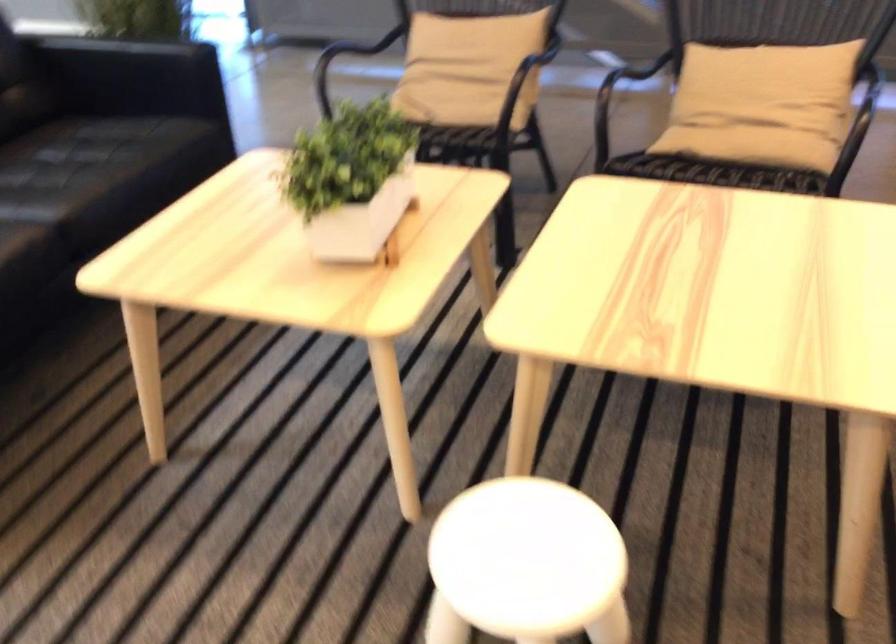
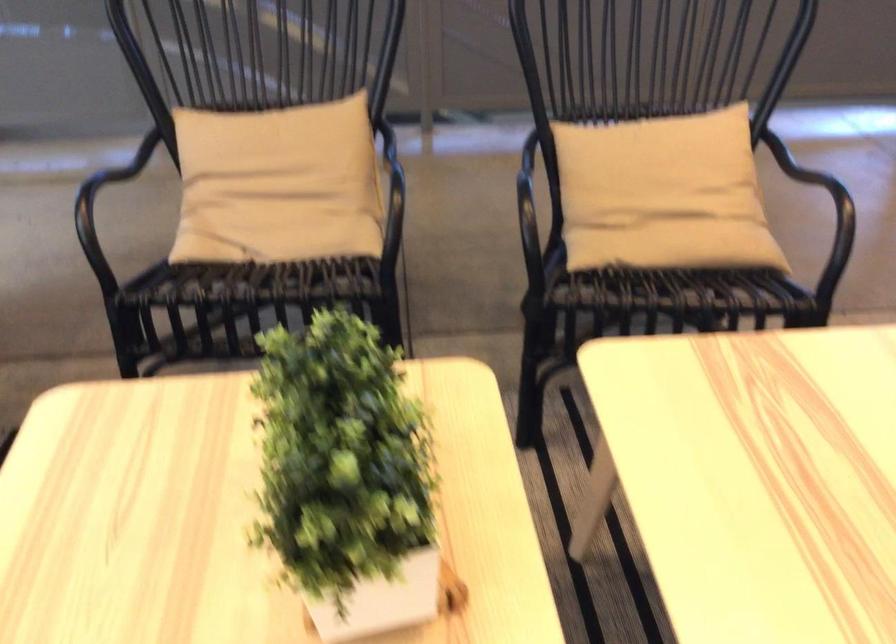
The point at (437, 122) is marked in the first image. Where is the corresponding point in the second image?

(268, 267)